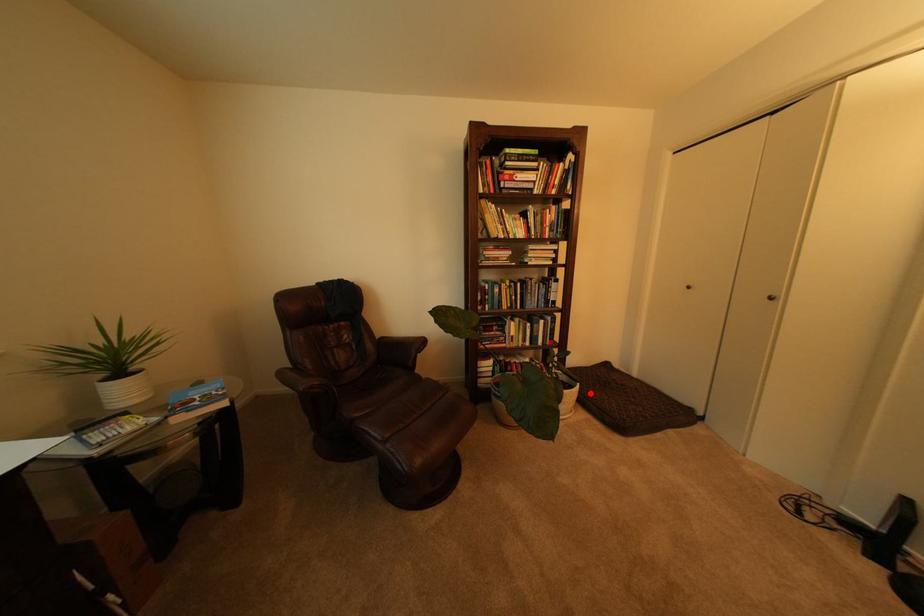
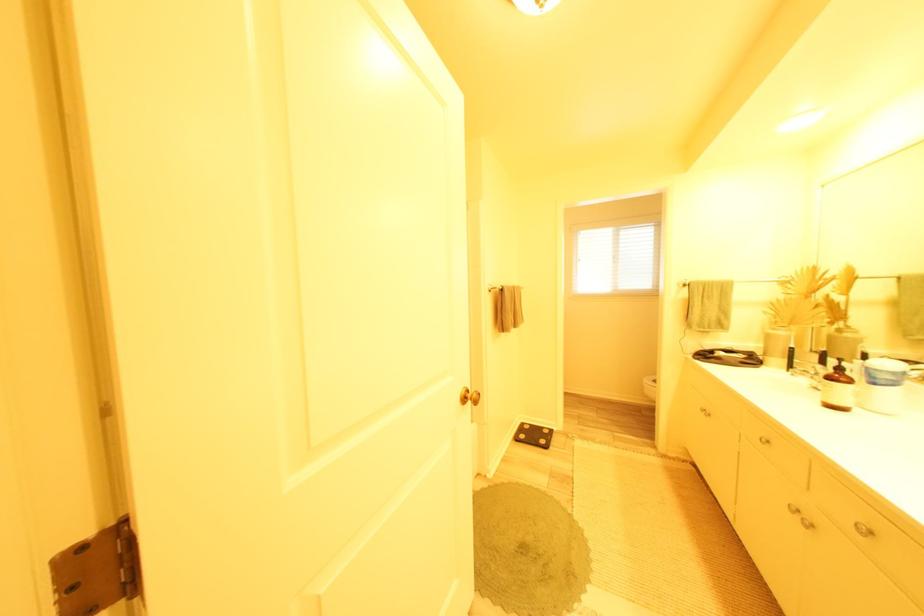
Question: I am providing you with two images of the same scene from different viewpoints. A red point is marked on the first image. Is the red point's position out of view in image 2?

Choices:
 (A) Yes
 (B) No

Answer: (A)